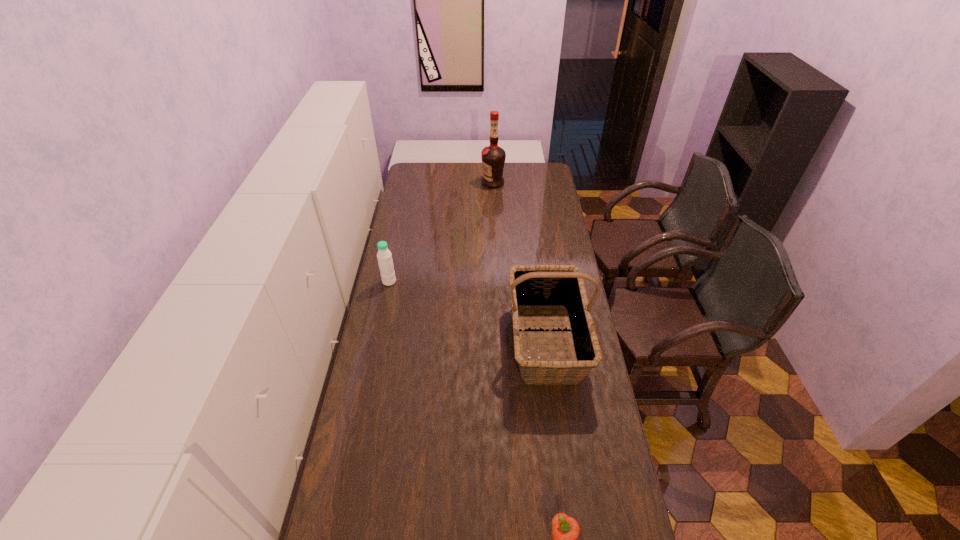
Where is `vacant area between the farthest object and the second nearest object`? vacant area between the farthest object and the second nearest object is located at coordinates (519, 262).

Locate which object ranks third in proximity to the third farthest object. Please provide its 2D coordinates. Your answer should be formatted as a tuple, i.e. [(x, y)], where the tuple contains the x and y coordinates of a point satisfying the conditions above.

[(493, 157)]

Where is `object that is the third nearest to the nearest object`? object that is the third nearest to the nearest object is located at coordinates (493, 157).

Where is `free space that satisfies the following two spatial constraints: 1. on the front and back of the liquor; 2. on the front side of the third tallest object`? free space that satisfies the following two spatial constraints: 1. on the front and back of the liquor; 2. on the front side of the third tallest object is located at coordinates (497, 281).